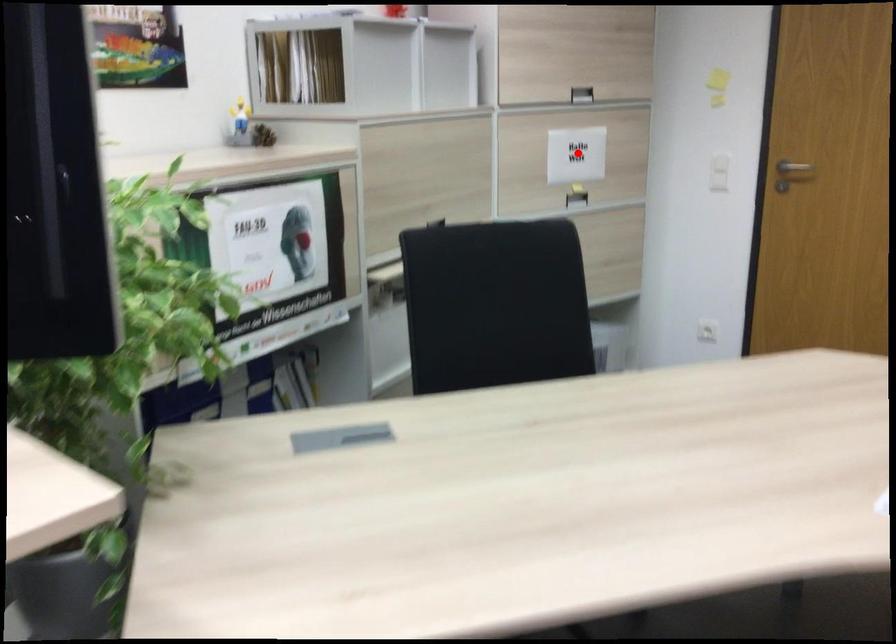
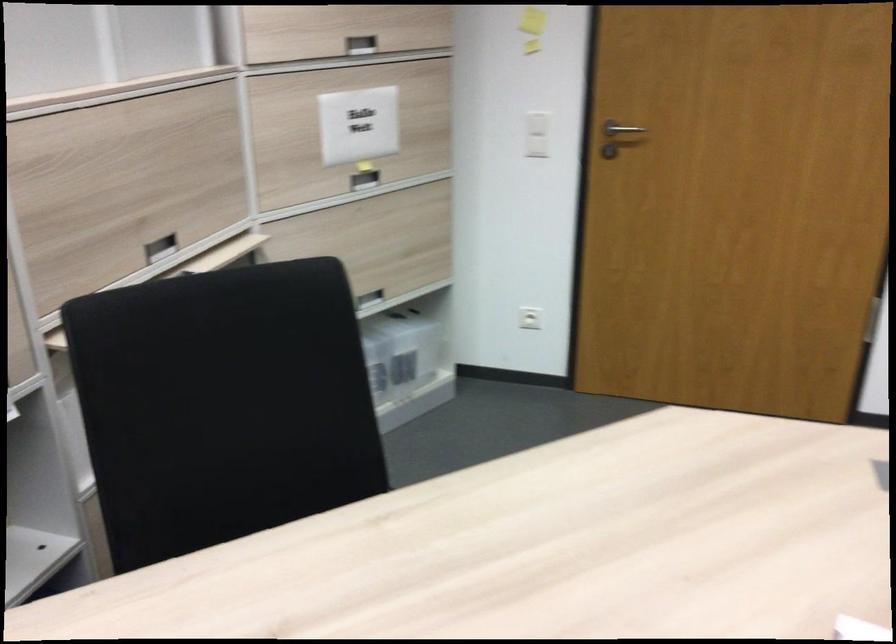
Question: A red point is marked in image1. In image2, is the corresponding 3D point closer to the camera or farther? Reply with the corresponding letter.

Choices:
 (A) The corresponding 3D point is closer.
 (B) The corresponding 3D point is farther.

Answer: (A)